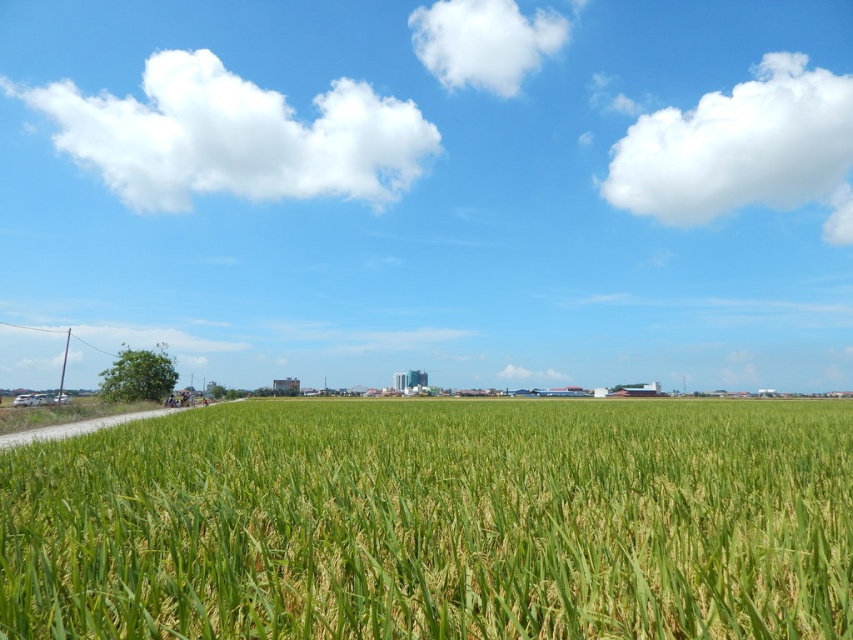
Can you confirm if white fluffy cloud at upper left is taller than white fluffy cloud at upper center?

Yes.

Describe the element at coordinates (233, 136) in the screenshot. This screenshot has height=640, width=853. I see `white fluffy cloud at upper left` at that location.

You are a GUI agent. You are given a task and a screenshot of the screen. Output one action in this format:
    pyautogui.click(x=<x>, y=<y>)
    Task: Click on the white fluffy cloud at upper left
    The height and width of the screenshot is (640, 853).
    Given the screenshot: What is the action you would take?
    pyautogui.click(x=233, y=136)

Is green grassy wheat field at center bigger than white fluffy cloud at upper center?

Yes, green grassy wheat field at center is bigger than white fluffy cloud at upper center.

Measure the distance between green grassy wheat field at center and camera.

They are 1.96 meters apart.

This screenshot has height=640, width=853. Find the location of `green grassy wheat field at center`. green grassy wheat field at center is located at coordinates (436, 522).

Does green grassy wheat field at center lie behind white fluffy cloud at upper right?

No, green grassy wheat field at center is closer to the viewer.

Between point (735, 440) and point (764, 129), which one is positioned behind?

Point (764, 129)

This screenshot has width=853, height=640. Identify the location of green grassy wheat field at center. (436, 522).